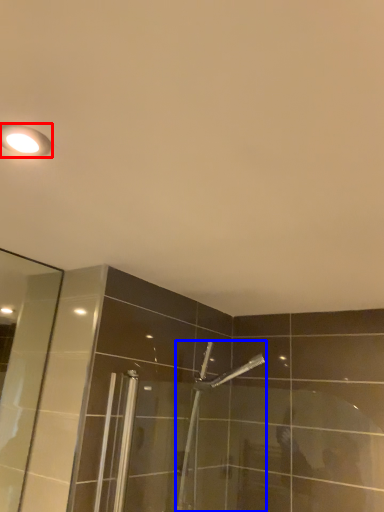
Question: Which object appears farthest to the camera in this image, light fixture (highlighted by a red box) or shower (highlighted by a blue box)?

Choices:
 (A) light fixture
 (B) shower

Answer: (B)